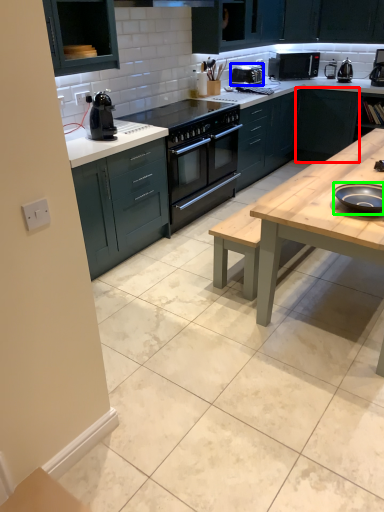
Question: Which is nearer to the cabinetry (highlighted by a red box)? appliance (highlighted by a blue box) or appliance (highlighted by a green box).

Choices:
 (A) appliance
 (B) appliance

Answer: (A)